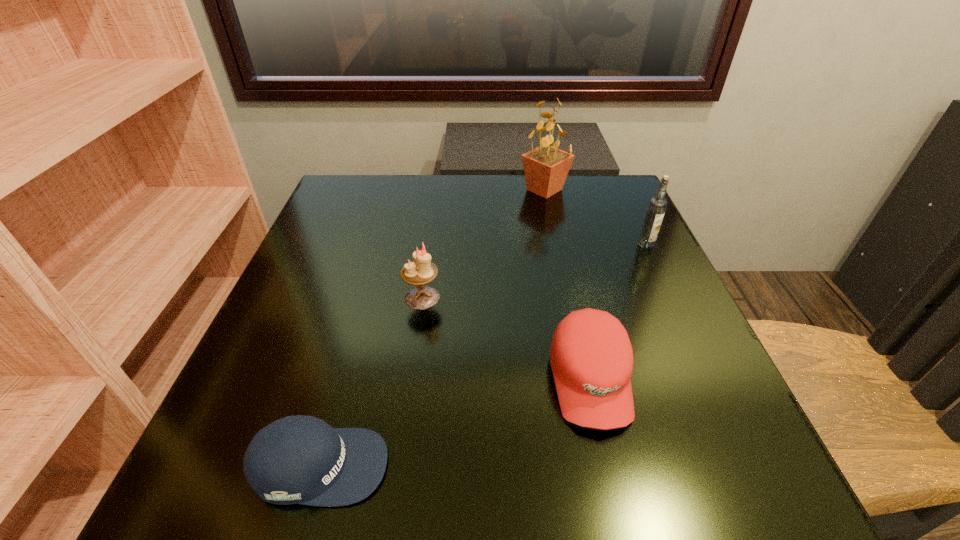
Locate an element on the screen. sunflower is located at coordinates (546, 167).

Locate an element on the screen. the farthest object is located at coordinates [546, 167].

In order to click on vodka in this screenshot , I will do `click(657, 205)`.

The width and height of the screenshot is (960, 540). I want to click on the second tallest object, so click(x=657, y=205).

I want to click on candle holder, so click(x=422, y=271).

Image resolution: width=960 pixels, height=540 pixels. Identify the location of the third farthest object. (422, 271).

Where is `the second shortest object`? The image size is (960, 540). the second shortest object is located at coordinates (591, 357).

At what (x,y) coordinates should I click in order to perform the action: click on baseball cap. Please return your answer as a coordinate pair (x, y). This screenshot has height=540, width=960. Looking at the image, I should click on (298, 459).

The height and width of the screenshot is (540, 960). In order to click on vacant space located at the front of the farthest object with flowers visible in this screenshot , I will do `click(450, 190)`.

The height and width of the screenshot is (540, 960). I want to click on vacant area situated at the front of the farthest object with flowers visible, so click(382, 190).